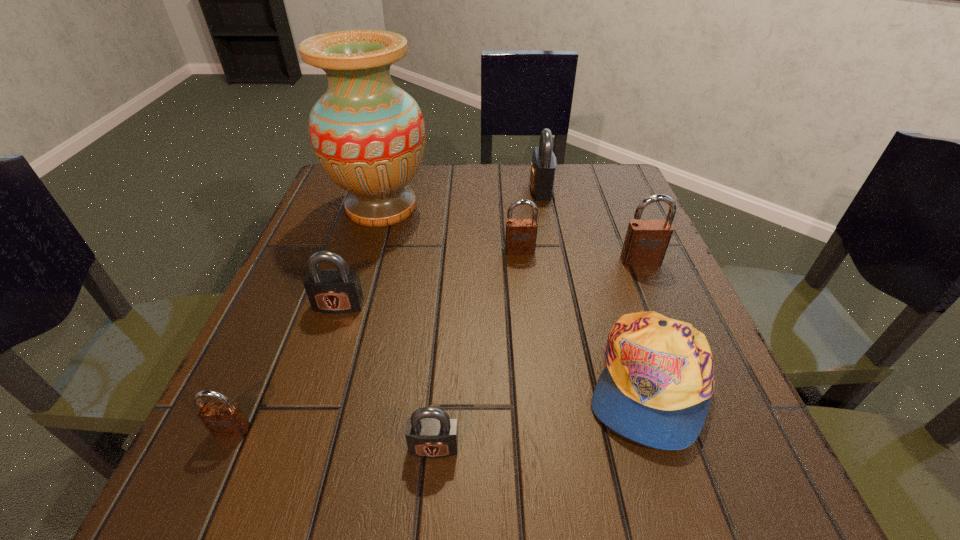
Find the location of a particular element. This screenshot has height=540, width=960. the fourth closest padlock relative to the biggest brown padlock is located at coordinates (334, 291).

Locate an element on the screen. The width and height of the screenshot is (960, 540). gray padlock that stands as the second closest to the cap is located at coordinates (334, 291).

This screenshot has height=540, width=960. In order to click on gray padlock that is the third closest to the fifth object from left to right in this screenshot , I will do `click(430, 433)`.

Locate which brown padlock ranks third in proximity to the cap. Please provide its 2D coordinates. Your answer should be formatted as a tuple, i.e. [(x, y)], where the tuple contains the x and y coordinates of a point satisfying the conditions above.

[(226, 418)]

Image resolution: width=960 pixels, height=540 pixels. Identify the location of brown padlock that can be found as the second closest to the nearest brown padlock. (646, 241).

Find the location of a particular element. Image resolution: width=960 pixels, height=540 pixels. free space that satisfies the following two spatial constraints: 1. on the front of the biggest gray padlock near the keyhole; 2. on the front-facing side of the leftmost brown padlock is located at coordinates (588, 430).

Where is `vacant space that satisfies the following two spatial constraints: 1. on the front of the rightmost gray padlock near the keyhole; 2. on the front-facing side of the smallest brown padlock`? The image size is (960, 540). vacant space that satisfies the following two spatial constraints: 1. on the front of the rightmost gray padlock near the keyhole; 2. on the front-facing side of the smallest brown padlock is located at coordinates (588, 430).